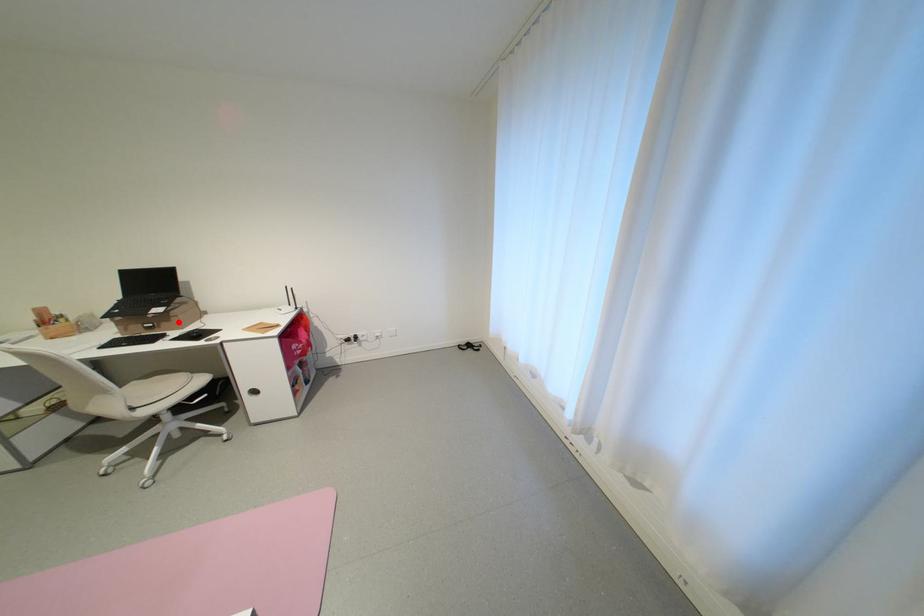
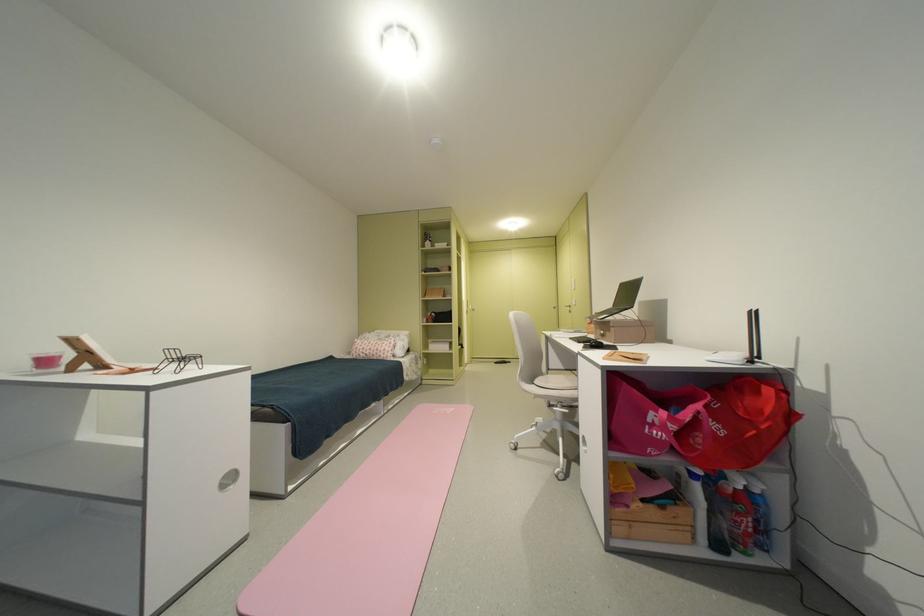
Find the pixel in the second image that matches the highlighted location in the first image.

(618, 331)